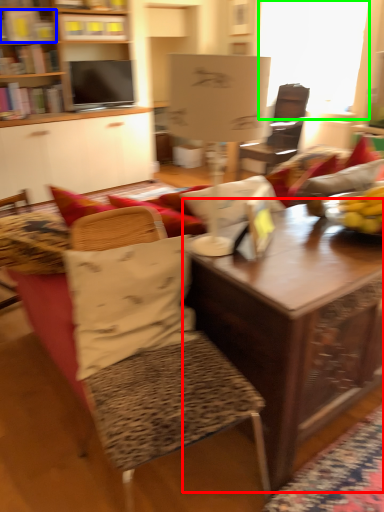
Question: Based on their relative distances, which object is nearer to table (highlighted by a red box)? Choose from book (highlighted by a blue box) and window screen (highlighted by a green box).

Choices:
 (A) book
 (B) window screen

Answer: (B)